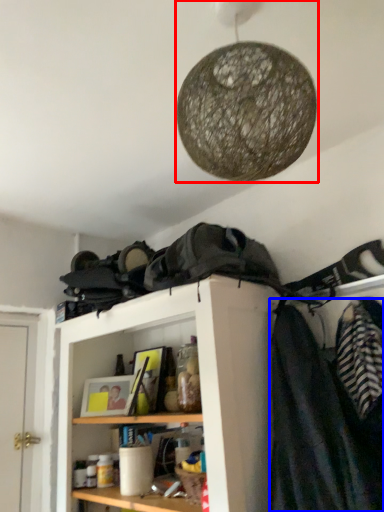
Question: Among these objects, which one is nearest to the camera, lamp (highlighted by a red box) or clothing (highlighted by a blue box)?

Choices:
 (A) lamp
 (B) clothing

Answer: (A)